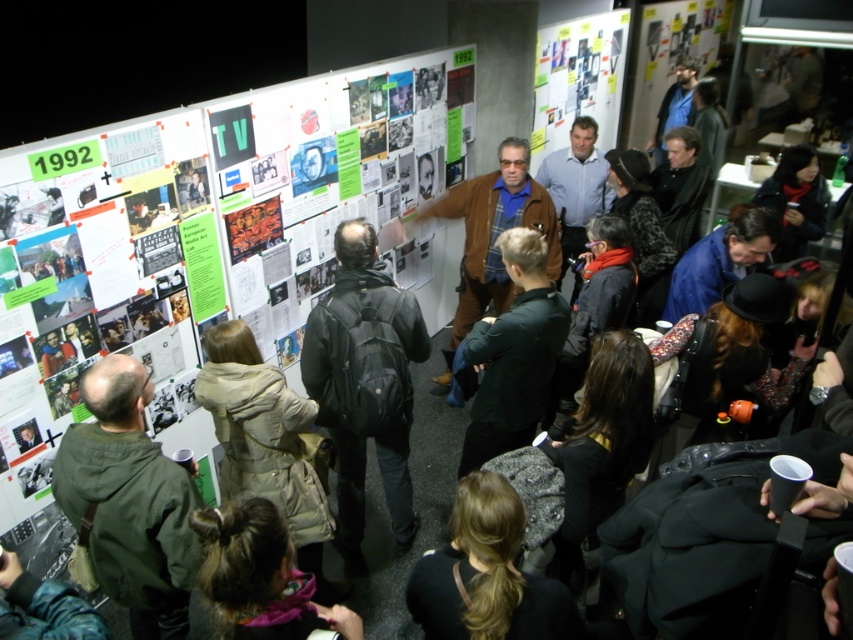
You are a photographer at the event and want to capture a clear photo of the dark brown hair at center without the tan leather coat at center blocking it. How should you adjust your camera angle?

The tan leather coat at center is located above dark brown hair at center, so you can lower your camera angle to capture the dark brown hair at center without obstruction from the tan leather coat at center.

You are a photographer holding a camera. You want to take a photo of the large display board without moving your feet. Is the green fabric jacket at lower left in your way?

The green fabric jacket at lower left and camera are 1.94 meters apart, so the jacket is not blocking the camera, so you can take the photo without moving.